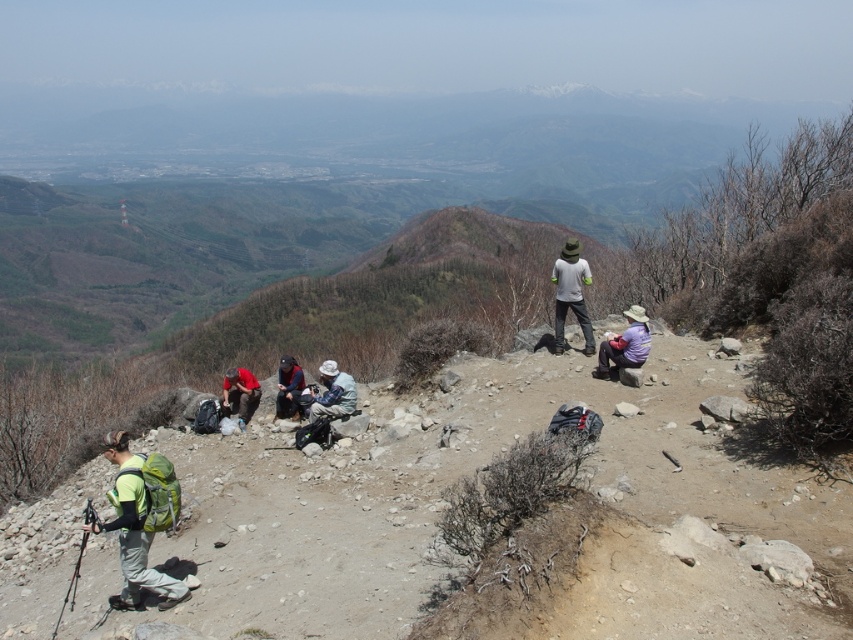
Question: Does light gray fabric jacket at upper center appear under dark blue fabric jacket at center?

Choices:
 (A) yes
 (B) no

Answer: (B)

Question: Which point appears farthest from the camera in this image?

Choices:
 (A) (283, 355)
 (B) (587, 266)
 (C) (227, 369)
 (D) (643, 355)

Answer: (A)

Question: Which of the following is the closest to the observer?

Choices:
 (A) dark blue fabric jacket at center
 (B) purple fabric hat at lower right
 (C) light gray fabric jacket at upper center

Answer: (B)

Question: Is red fabric shirt at center behind dark blue fabric jacket at center?

Choices:
 (A) yes
 (B) no

Answer: (A)

Question: Is light gray fabric hat at center above dark blue fabric jacket at center?

Choices:
 (A) yes
 (B) no

Answer: (A)

Question: Based on their relative distances, which object is nearer to the light gray fabric jacket at upper center?

Choices:
 (A) purple fabric hat at lower right
 (B) red fabric shirt at center

Answer: (A)